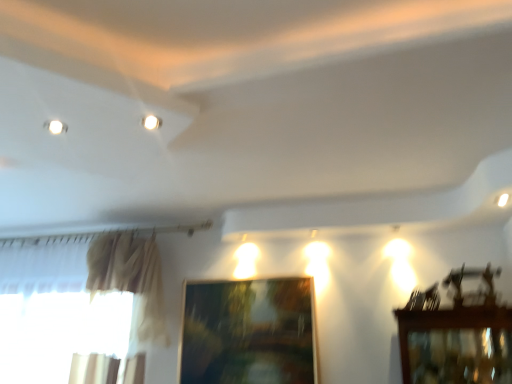
Question: Can you confirm if wooden picture frame at center is smaller than white glossy light fixture at upper center?

Choices:
 (A) yes
 (B) no

Answer: (B)

Question: Considering the relative sizes of wooden picture frame at center and white glossy light fixture at upper center in the image provided, is wooden picture frame at center wider than white glossy light fixture at upper center?

Choices:
 (A) yes
 (B) no

Answer: (B)

Question: Does wooden picture frame at center come in front of white glossy light fixture at upper center?

Choices:
 (A) yes
 (B) no

Answer: (B)

Question: Does wooden picture frame at center have a lesser height compared to white glossy light fixture at upper center?

Choices:
 (A) no
 (B) yes

Answer: (A)

Question: From a real-world perspective, is wooden picture frame at center on white glossy light fixture at upper center?

Choices:
 (A) yes
 (B) no

Answer: (B)

Question: Is wooden picture frame at center to the left of white glossy light fixture at upper center from the viewer's perspective?

Choices:
 (A) no
 (B) yes

Answer: (A)

Question: Is white glossy light fixture at upper center beside wooden picture frame at center?

Choices:
 (A) yes
 (B) no

Answer: (B)

Question: From a real-world perspective, is white glossy light fixture at upper center positioned over wooden picture frame at center based on gravity?

Choices:
 (A) no
 (B) yes

Answer: (B)

Question: Is white glossy light fixture at upper center at the right side of wooden picture frame at center?

Choices:
 (A) no
 (B) yes

Answer: (A)

Question: Considering the relative sizes of white glossy light fixture at upper center and wooden picture frame at center in the image provided, is white glossy light fixture at upper center smaller than wooden picture frame at center?

Choices:
 (A) yes
 (B) no

Answer: (A)

Question: Is white glossy light fixture at upper center not inside wooden picture frame at center?

Choices:
 (A) no
 (B) yes

Answer: (B)

Question: Is white glossy light fixture at upper center behind wooden picture frame at center?

Choices:
 (A) yes
 (B) no

Answer: (B)

Question: Considering the relative positions of white glossy light at upper right and white glossy light fixture at upper center in the image provided, is white glossy light at upper right to the right of white glossy light fixture at upper center from the viewer's perspective?

Choices:
 (A) yes
 (B) no

Answer: (A)